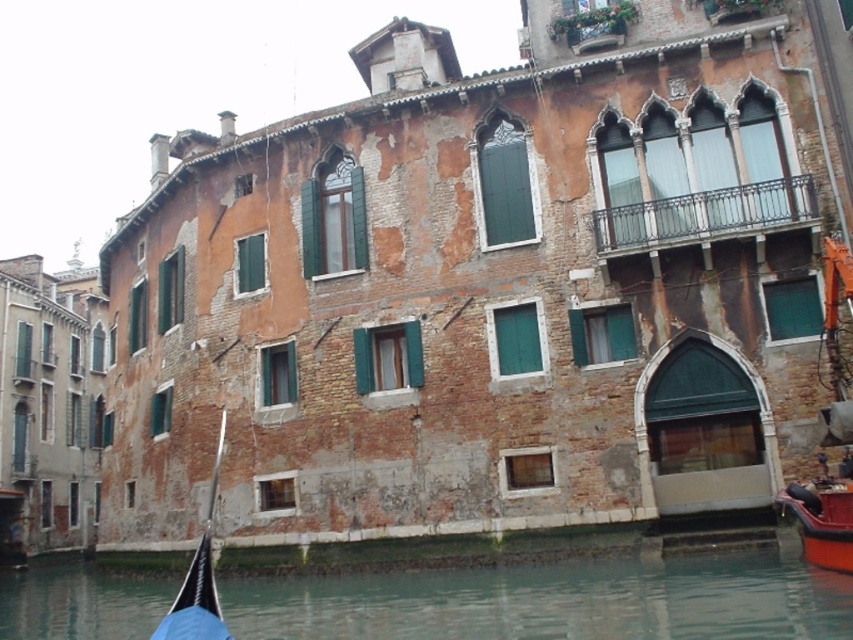
Question: Which object is farther from the camera taking this photo?

Choices:
 (A) clear water at lower center
 (B) black fabric boat at lower left

Answer: (A)

Question: Can you confirm if clear water at lower center is bigger than black fabric boat at lower left?

Choices:
 (A) yes
 (B) no

Answer: (A)

Question: From the image, what is the correct spatial relationship of clear water at lower center in relation to black fabric boat at lower left?

Choices:
 (A) right
 (B) left

Answer: (B)

Question: Which object appears closest to the camera in this image?

Choices:
 (A) black fabric boat at lower left
 (B) clear water at lower center

Answer: (A)

Question: From the image, what is the correct spatial relationship of clear water at lower center in relation to black fabric boat at lower left?

Choices:
 (A) left
 (B) right

Answer: (A)